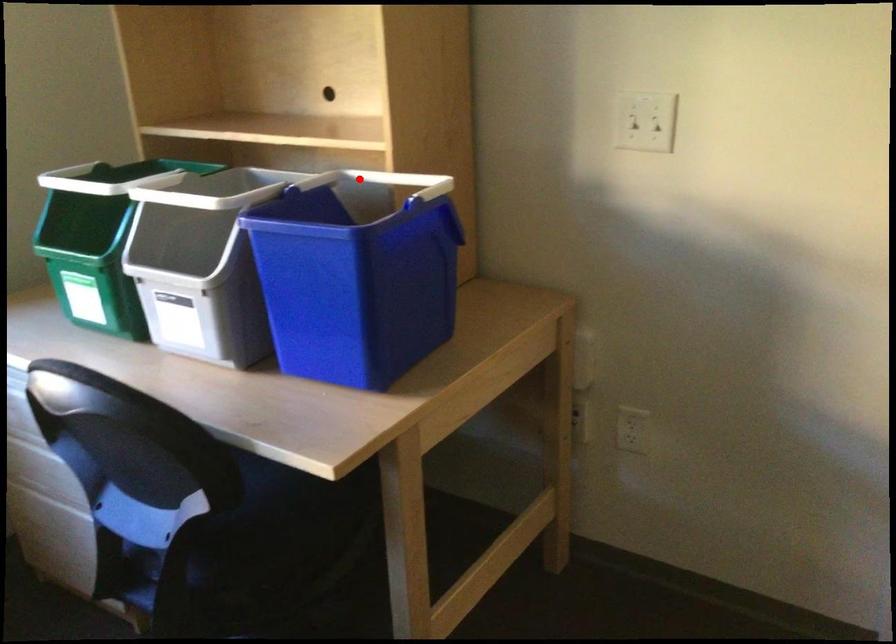
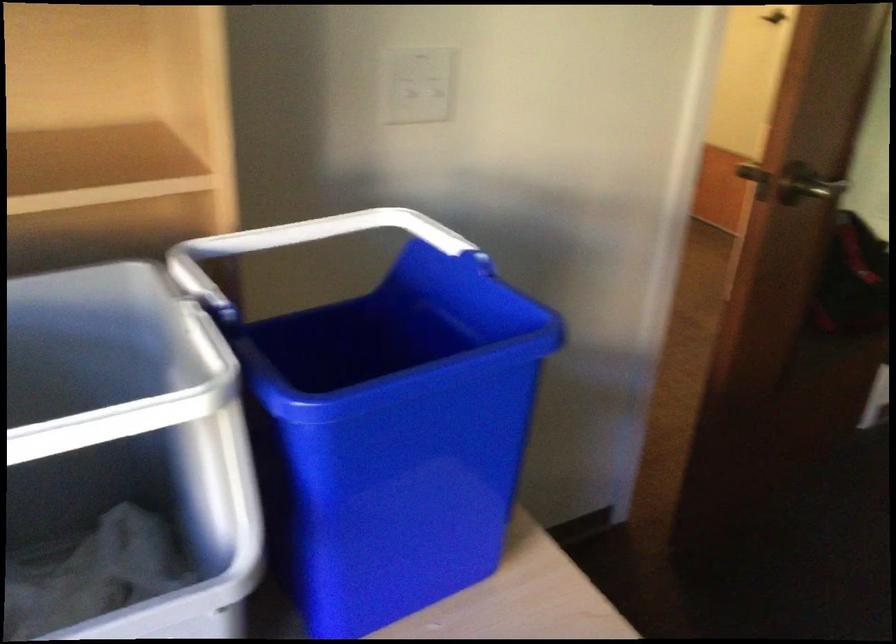
Question: A red point is marked in image1. In image2, is the corresponding 3D point closer to the camera or farther? Reply with the corresponding letter.

Choices:
 (A) The corresponding 3D point is closer.
 (B) The corresponding 3D point is farther.

Answer: (A)